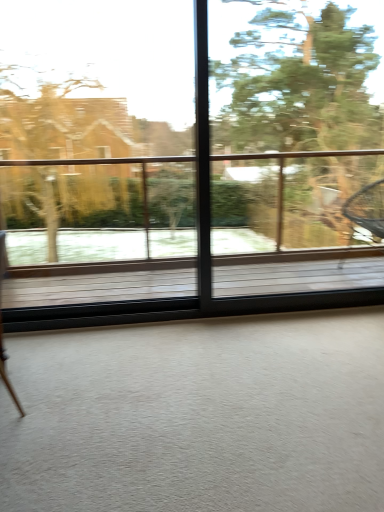
I want to click on transparent glass window at center, so click(x=214, y=191).

Measure the distance between point (245, 79) and camera.

Point (245, 79) and camera are 3.71 meters apart.

What do you see at coordinates (214, 191) in the screenshot?
I see `transparent glass window at center` at bounding box center [214, 191].

The width and height of the screenshot is (384, 512). What do you see at coordinates (295, 80) in the screenshot?
I see `green leafy tree at upper right` at bounding box center [295, 80].

At what (x,y) coordinates should I click in order to perform the action: click on green leafy tree at upper right. Please return your answer as a coordinate pair (x, y). Looking at the image, I should click on (295, 80).

Identify the location of transparent glass window at center. This screenshot has height=512, width=384. (214, 191).

Does green leafy tree at upper right appear on the left side of transparent glass window at center?

No.

Which object is further away from the camera, green leafy tree at upper right or transparent glass window at center?

Positioned behind is green leafy tree at upper right.

Is point (222, 50) positioned before point (312, 220)?

Yes.

Consider the image. From the image's perspective, is green leafy tree at upper right below transparent glass window at center?

Incorrect, from the image's perspective, green leafy tree at upper right is higher than transparent glass window at center.

From a real-world perspective, which object stands above the other?

From a 3D spatial view, green leafy tree at upper right is above.

Considering the relative sizes of green leafy tree at upper right and transparent glass window at center in the image provided, is green leafy tree at upper right thinner than transparent glass window at center?

No, green leafy tree at upper right is not thinner than transparent glass window at center.

Between green leafy tree at upper right and transparent glass window at center, which one has less height?

With less height is green leafy tree at upper right.

Who is smaller, green leafy tree at upper right or transparent glass window at center?

Smaller between the two is transparent glass window at center.

Is green leafy tree at upper right completely or partially outside of transparent glass window at center?

No, green leafy tree at upper right is inside or overlapping with transparent glass window at center.

Is green leafy tree at upper right far away from transparent glass window at center?

Actually, green leafy tree at upper right and transparent glass window at center are a little close together.

Is green leafy tree at upper right positioned with its back to transparent glass window at center?

Yes, green leafy tree at upper right's orientation is away from transparent glass window at center.

What's the angular difference between green leafy tree at upper right and transparent glass window at center's facing directions?

0.00517 degrees separate the facing orientations of green leafy tree at upper right and transparent glass window at center.

In the image, there is a transparent glass window at center. Where is `tree above it (from the image's perspective)`? The width and height of the screenshot is (384, 512). tree above it (from the image's perspective) is located at coordinates (295, 80).

Between transparent glass window at center and green leafy tree at upper right, which one appears on the right side from the viewer's perspective?

green leafy tree at upper right.

Which is in front, transparent glass window at center or green leafy tree at upper right?

transparent glass window at center is more forward.

Does point (58, 158) come closer to viewer compared to point (340, 47)?

Yes, point (58, 158) is in front of point (340, 47).

From the picture: From the image's perspective, between transparent glass window at center and green leafy tree at upper right, which one is located above?

green leafy tree at upper right.

From a real-world perspective, is transparent glass window at center over green leafy tree at upper right?

Actually, transparent glass window at center is physically below green leafy tree at upper right in the real world.

In the scene shown: Which of these two, transparent glass window at center or green leafy tree at upper right, is wider?

With larger width is green leafy tree at upper right.

From their relative heights in the image, would you say transparent glass window at center is taller or shorter than green leafy tree at upper right?

Considering their sizes, transparent glass window at center has more height than green leafy tree at upper right.

Can you confirm if transparent glass window at center is bigger than green leafy tree at upper right?

Actually, transparent glass window at center might be smaller than green leafy tree at upper right.

Looking at this image, can we say transparent glass window at center lies outside green leafy tree at upper right?

No, transparent glass window at center is inside green leafy tree at upper right's boundary.

Is transparent glass window at center positioned far away from green leafy tree at upper right?

They are positioned close to each other.

Is transparent glass window at center looking in the opposite direction of green leafy tree at upper right?

That's right, transparent glass window at center is facing away from green leafy tree at upper right.

Can you tell me how much transparent glass window at center and green leafy tree at upper right differ in facing direction?

The angle between the facing direction of transparent glass window at center and the facing direction of green leafy tree at upper right is 0.00517 degrees.

This screenshot has height=512, width=384. What are the coordinates of `window located in front of the green leafy tree at upper right` in the screenshot? It's located at (214, 191).

The image size is (384, 512). Identify the location of window below the green leafy tree at upper right (from the image's perspective). (214, 191).

I want to click on window on the left of green leafy tree at upper right, so click(x=214, y=191).